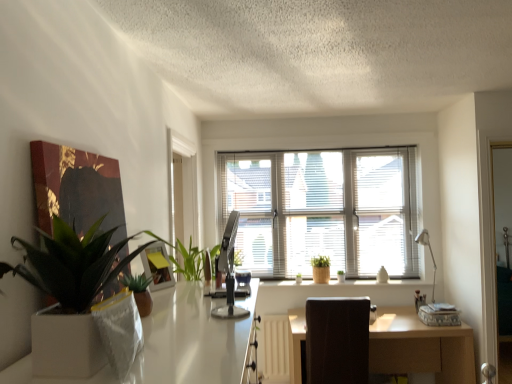
Question: Considering the positions of point (320, 327) and point (408, 342), is point (320, 327) closer or farther from the camera than point (408, 342)?

Choices:
 (A) closer
 (B) farther

Answer: (A)

Question: In the image, is brown fabric swivel chair at center positioned in front of or behind light brown wooden desk at center?

Choices:
 (A) front
 (B) behind

Answer: (A)

Question: Which is nearer to the white blinds at center?

Choices:
 (A) light brown wooden desk at center
 (B) yellow paper picture frame at upper center
 (C) brown fabric swivel chair at center
 (D) green woven basket at center, marked as the second houseplant in a front-to-back arrangement
 (E) green matte plant at left, which is counted as the 1th houseplant, starting from the front

Answer: (D)

Question: Which of these objects is positioned farthest from the green matte plant at left, the first houseplant in the left-to-right sequence?

Choices:
 (A) light brown wooden desk at center
 (B) white ceramic vase at center
 (C) silver metallic desk lamp at right
 (D) green woven basket at center, which is the first houseplant in back-to-front order
 (E) white glossy desk at center

Answer: (C)